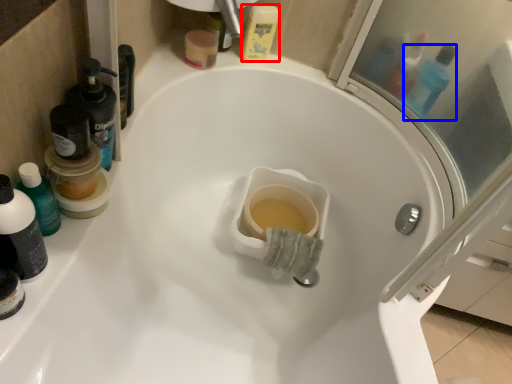
Question: Which object is further to the camera taking this photo, mouthwash (highlighted by a red box) or mouthwash (highlighted by a blue box)?

Choices:
 (A) mouthwash
 (B) mouthwash

Answer: (A)